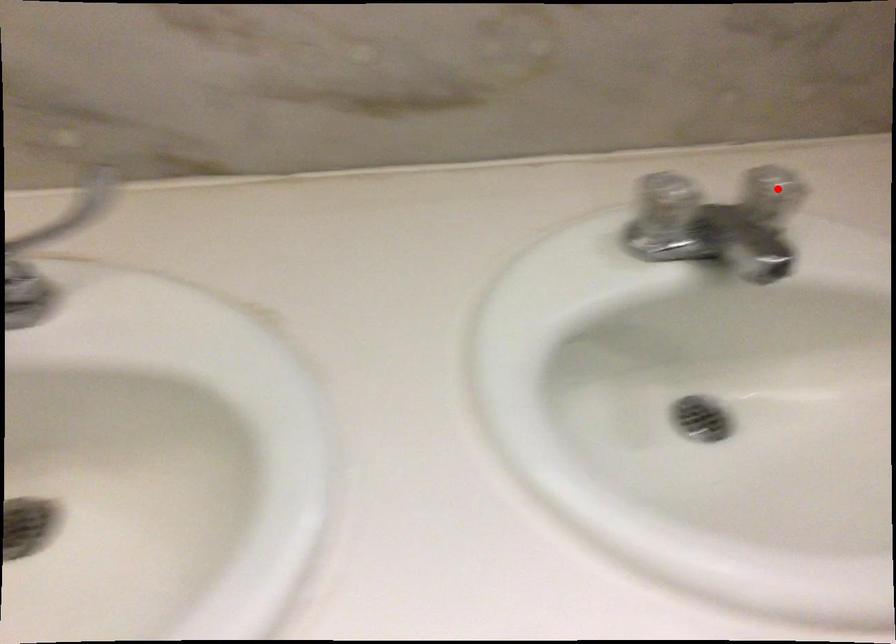
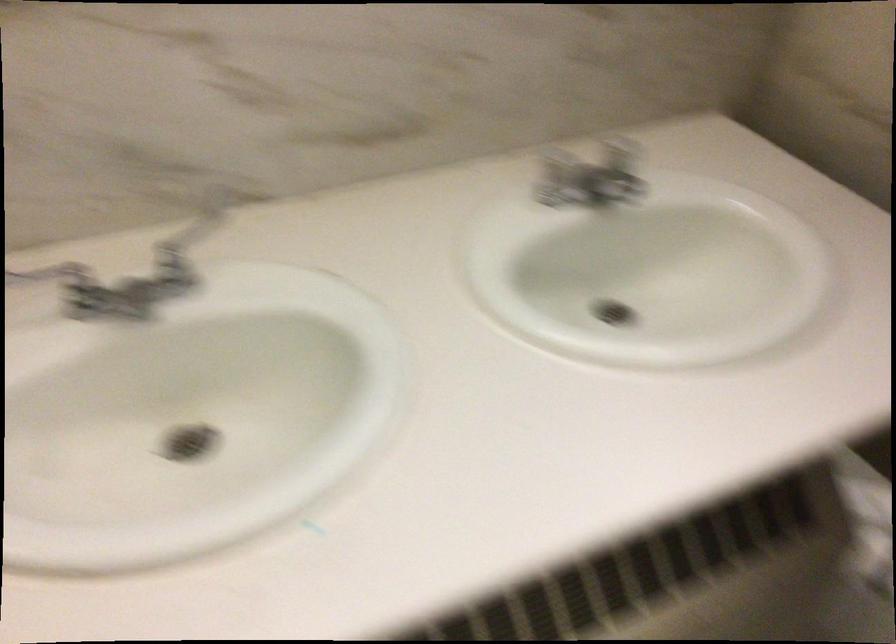
Locate, in the second image, the point that corresponds to the highlighted location in the first image.

(622, 147)